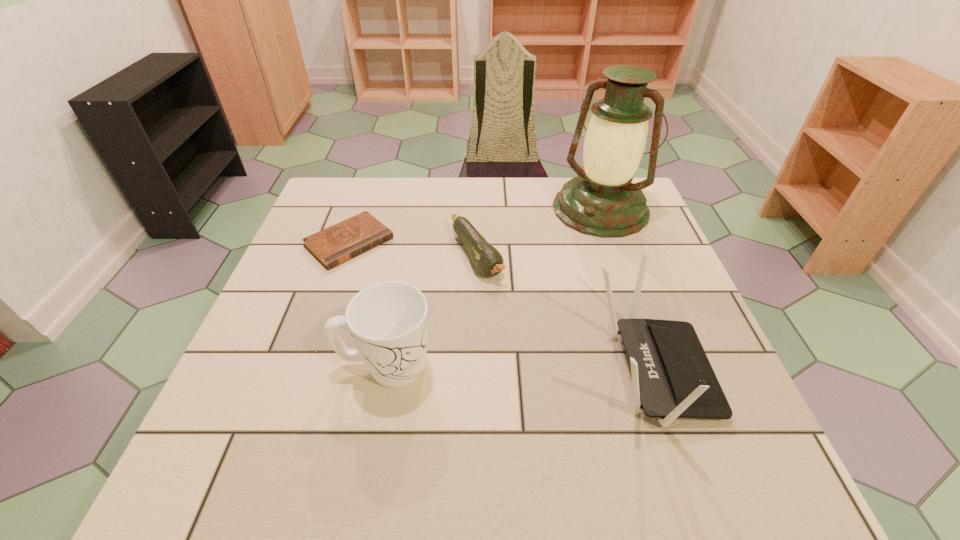
Locate an element on the screen. vacant space on the desktop that is between the mug and the router and is positioned on the spine side of the shortest object is located at coordinates (491, 369).

This screenshot has width=960, height=540. What are the coordinates of `free space on the desktop that is between the mug and the router and is positioned at the blossom end of the fourth tallest object` in the screenshot? It's located at (548, 370).

At what (x,y) coordinates should I click in order to perform the action: click on free space on the desktop that is between the mug and the router and is positioned with the light compartment facing forward on the tallest object. Please return your answer as a coordinate pair (x, y). Image resolution: width=960 pixels, height=540 pixels. Looking at the image, I should click on (482, 368).